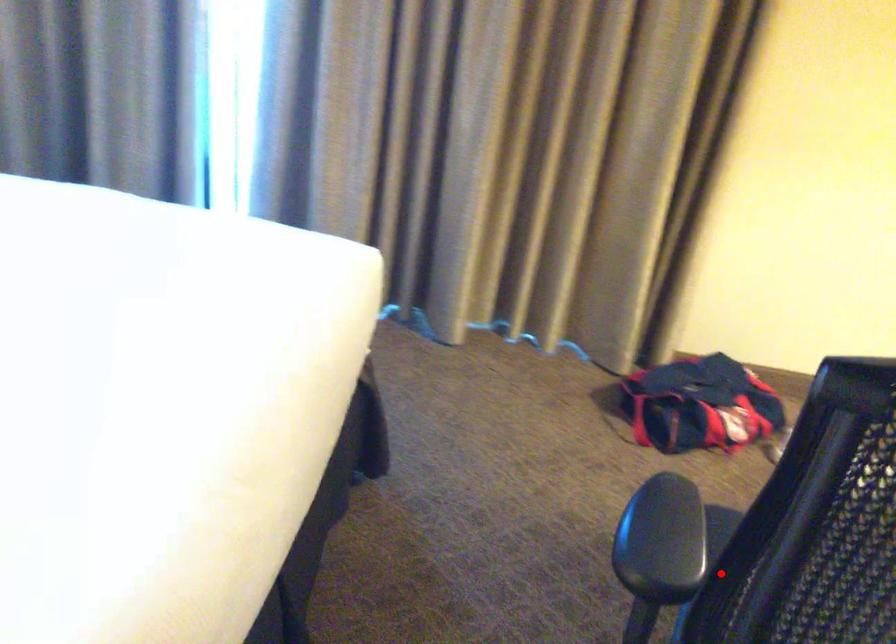
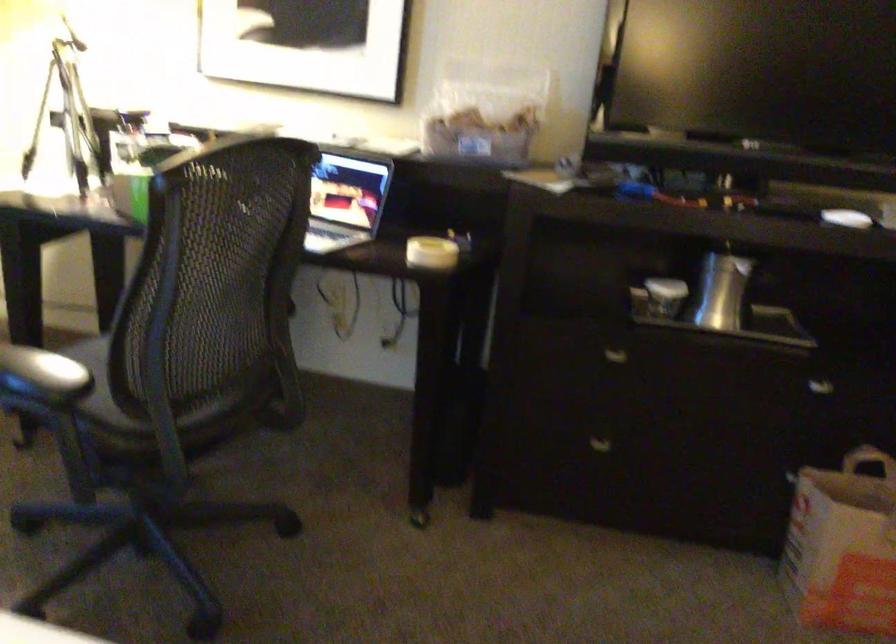
Question: I am providing you with two images of the same scene from different viewpoints. Given a red point in image1, look at the same physical point in image2. Is it:

Choices:
 (A) Closer to the viewpoint
 (B) Farther from the viewpoint

Answer: (B)